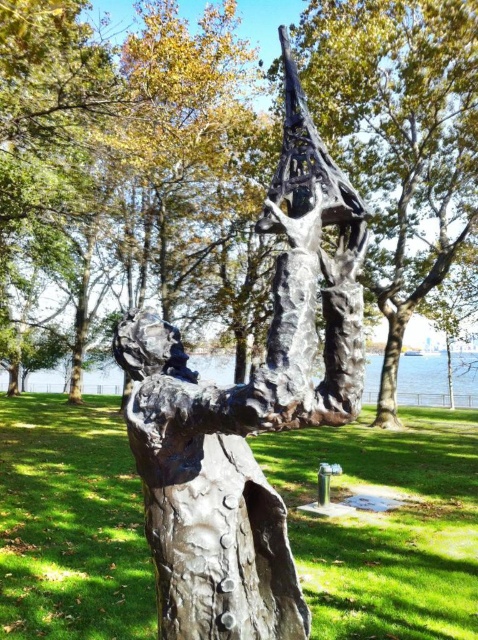
Question: Considering the relative positions of rusty metal sculpture at center and smooth brown tree trunk at center in the image provided, where is rusty metal sculpture at center located with respect to smooth brown tree trunk at center?

Choices:
 (A) right
 (B) left

Answer: (A)

Question: Observing the image, what is the correct spatial positioning of shiny silver sculpture at center in reference to green grass at center?

Choices:
 (A) right
 (B) left

Answer: (B)

Question: Which of these objects is positioned farthest from the smooth brown tree trunk at center?

Choices:
 (A) rusty metal sculpture at center
 (B) shiny silver sculpture at center

Answer: (B)

Question: Can you confirm if shiny silver sculpture at center is bigger than smooth brown tree trunk at center?

Choices:
 (A) yes
 (B) no

Answer: (A)

Question: Which object appears closest to the camera in this image?

Choices:
 (A) smooth brown tree trunk at center
 (B) green grass at center

Answer: (B)

Question: Based on their relative distances, which object is nearer to the bronze sculpture at center?

Choices:
 (A) green grass at center
 (B) smooth brown tree trunk at center

Answer: (A)